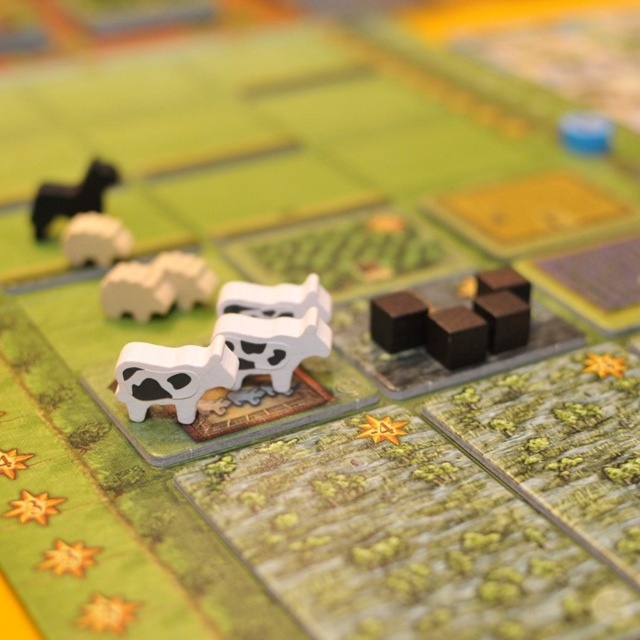
You are a player in a board game trying to stack items. You have a white matte cow at center and shiny dark brown cubes at center right in front of you. Which item can you place on top of the other without it falling over?

The white matte cow at center is much taller than the shiny dark brown cubes at center right, so you can place the cubes on top of the cow.

You are a player in a board game trying to move your piece from point A to point B. You see two points on the board labeled as point [296,298] and point [500,276]. Which point is closer to you?

Point [296,298] is closer to you because it is in front of point [500,276].